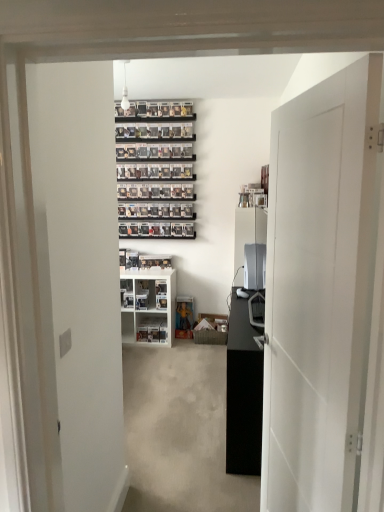
Question: Is white plastic shelf at center, arranged as the first shelf when ordered from the bottom, in front of black matte cabinet at center?

Choices:
 (A) no
 (B) yes

Answer: (A)

Question: Considering the relative sizes of white plastic shelf at center, placed as the 2th shelf when sorted from top to bottom, and black matte cabinet at center in the image provided, is white plastic shelf at center, placed as the 2th shelf when sorted from top to bottom, smaller than black matte cabinet at center?

Choices:
 (A) no
 (B) yes

Answer: (B)

Question: From the image's perspective, does white plastic shelf at center, placed as the 2th shelf when sorted from top to bottom, appear higher than black matte cabinet at center?

Choices:
 (A) yes
 (B) no

Answer: (B)

Question: From the image's perspective, is white plastic shelf at center, placed as the 2th shelf when sorted from top to bottom, beneath black matte cabinet at center?

Choices:
 (A) yes
 (B) no

Answer: (A)

Question: Is white plastic shelf at center, placed as the 2th shelf when sorted from top to bottom, in contact with black matte cabinet at center?

Choices:
 (A) no
 (B) yes

Answer: (A)

Question: Is satin silver desktop at center wider or thinner than white plastic shelf at center, acting as the first shelf starting from the top?

Choices:
 (A) thin
 (B) wide

Answer: (A)

Question: Is point (253, 245) positioned closer to the camera than point (155, 329)?

Choices:
 (A) closer
 (B) farther

Answer: (A)

Question: From the image's perspective, is satin silver desktop at center above or below white plastic shelf at center, acting as the first shelf starting from the top?

Choices:
 (A) below
 (B) above

Answer: (B)

Question: Considering their positions, is satin silver desktop at center located in front of or behind white plastic shelf at center, acting as the first shelf starting from the top?

Choices:
 (A) behind
 (B) front

Answer: (B)

Question: Is white plastic shelf at center, acting as the first shelf starting from the top, to the left or to the right of white matte door at right in the image?

Choices:
 (A) left
 (B) right

Answer: (A)

Question: Is white plastic shelf at center, which is the 2th shelf from bottom to top, inside the boundaries of white matte door at right, or outside?

Choices:
 (A) outside
 (B) inside

Answer: (A)

Question: Looking at their shapes, would you say white plastic shelf at center, which is the 2th shelf from bottom to top, is wider or thinner than white matte door at right?

Choices:
 (A) thin
 (B) wide

Answer: (B)

Question: In terms of size, does white plastic shelf at center, which is the 2th shelf from bottom to top, appear bigger or smaller than white matte door at right?

Choices:
 (A) big
 (B) small

Answer: (A)

Question: In terms of height, does satin silver desktop at center look taller or shorter compared to black matte cabinet at center?

Choices:
 (A) short
 (B) tall

Answer: (A)

Question: From the image's perspective, relative to black matte cabinet at center, is satin silver desktop at center above or below?

Choices:
 (A) above
 (B) below

Answer: (A)